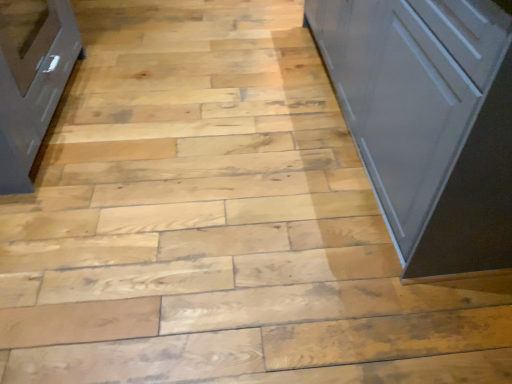
In order to face matte gray cabinet at left, should I rotate leftwards or rightwards?

Rotate left and turn 32.059 degrees.

Where is `matte gray cabinet at left`? matte gray cabinet at left is located at coordinates (31, 80).

The width and height of the screenshot is (512, 384). Describe the element at coordinates (31, 80) in the screenshot. I see `matte gray cabinet at left` at that location.

Where is `white glossy cupboard at right`? This screenshot has height=384, width=512. white glossy cupboard at right is located at coordinates (428, 123).

Describe the element at coordinates (428, 123) in the screenshot. The width and height of the screenshot is (512, 384). I see `white glossy cupboard at right` at that location.

Locate an element on the screen. matte gray cabinet at left is located at coordinates (31, 80).

Which object is positioned more to the left, white glossy cupboard at right or matte gray cabinet at left?

From the viewer's perspective, matte gray cabinet at left appears more on the left side.

Which object is more forward, white glossy cupboard at right or matte gray cabinet at left?

white glossy cupboard at right is more forward.

Considering the positions of point (406, 265) and point (5, 28), is point (406, 265) closer or farther from the camera than point (5, 28)?

Point (406, 265) is positioned closer to the camera compared to point (5, 28).

From the image's perspective, is white glossy cupboard at right below matte gray cabinet at left?

Incorrect, from the image's perspective, white glossy cupboard at right is higher than matte gray cabinet at left.

From a real-world perspective, relative to matte gray cabinet at left, is white glossy cupboard at right vertically above or below?

In terms of real-world spatial position, white glossy cupboard at right is above matte gray cabinet at left.

Is white glossy cupboard at right wider than matte gray cabinet at left?

Correct, the width of white glossy cupboard at right exceeds that of matte gray cabinet at left.

Which of these two, white glossy cupboard at right or matte gray cabinet at left, stands taller?

Standing taller between the two is white glossy cupboard at right.

Considering the sizes of objects white glossy cupboard at right and matte gray cabinet at left in the image provided, who is smaller, white glossy cupboard at right or matte gray cabinet at left?

matte gray cabinet at left is smaller.

Can we say white glossy cupboard at right lies outside matte gray cabinet at left?

white glossy cupboard at right is positioned outside matte gray cabinet at left.

Based on the photo, would you say white glossy cupboard at right is a long distance from matte gray cabinet at left?

Absolutely, white glossy cupboard at right is distant from matte gray cabinet at left.

Is white glossy cupboard at right looking in the opposite direction of matte gray cabinet at left?

Absolutely, white glossy cupboard at right is directed away from matte gray cabinet at left.

Measure the distance between white glossy cupboard at right and matte gray cabinet at left.

white glossy cupboard at right is 1.33 meters away from matte gray cabinet at left.

Where is `cabinetry below the white glossy cupboard at right (from a real-world perspective)`? This screenshot has width=512, height=384. cabinetry below the white glossy cupboard at right (from a real-world perspective) is located at coordinates (31, 80).

Is matte gray cabinet at left at the left side of white glossy cupboard at right?

Yes.

Which is behind, matte gray cabinet at left or white glossy cupboard at right?

matte gray cabinet at left is further away from the camera.

Which is nearer, (44, 98) or (483, 167)?

Point (44, 98).

From the image's perspective, is matte gray cabinet at left above or below white glossy cupboard at right?

Clearly, from the image's perspective, matte gray cabinet at left is below white glossy cupboard at right.

From a real-world perspective, does matte gray cabinet at left stand above white glossy cupboard at right?

Actually, matte gray cabinet at left is physically below white glossy cupboard at right in the real world.

Does matte gray cabinet at left have a lesser width compared to white glossy cupboard at right?

Correct, the width of matte gray cabinet at left is less than that of white glossy cupboard at right.

Can you confirm if matte gray cabinet at left is taller than white glossy cupboard at right?

No.

Which of these two, matte gray cabinet at left or white glossy cupboard at right, is smaller?

With smaller size is matte gray cabinet at left.

Which is correct: matte gray cabinet at left is inside white glossy cupboard at right, or outside of it?

matte gray cabinet at left lies outside white glossy cupboard at right.

Is there a large distance between matte gray cabinet at left and white glossy cupboard at right?

Yes, matte gray cabinet at left and white glossy cupboard at right are located far from each other.

In the scene shown: Is matte gray cabinet at left facing away from white glossy cupboard at right?

No, matte gray cabinet at left's orientation is not away from white glossy cupboard at right.

Looking at this image, how many degrees apart are the facing directions of matte gray cabinet at left and white glossy cupboard at right?

There is a 0.806-degree angle between the facing directions of matte gray cabinet at left and white glossy cupboard at right.

Find the location of a particular element. cupboard on the right of matte gray cabinet at left is located at coordinates (428, 123).

The height and width of the screenshot is (384, 512). Identify the location of cabinetry behind the white glossy cupboard at right. (31, 80).

Identify the location of cabinetry located below the white glossy cupboard at right (from the image's perspective). The image size is (512, 384). (31, 80).